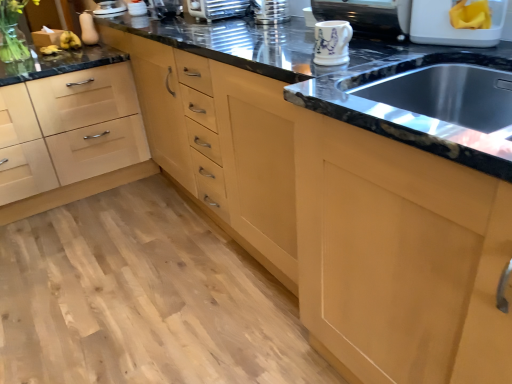
Question: Is clear glass vase at upper left to the left of metallic silver toaster at upper center, the 4th appliance when ordered from right to left, from the viewer's perspective?

Choices:
 (A) no
 (B) yes

Answer: (B)

Question: Does clear glass vase at upper left have a smaller size compared to metallic silver toaster at upper center, the 4th appliance when ordered from right to left?

Choices:
 (A) yes
 (B) no

Answer: (B)

Question: From the image's perspective, is clear glass vase at upper left beneath metallic silver toaster at upper center, the 4th appliance when ordered from right to left?

Choices:
 (A) no
 (B) yes

Answer: (A)

Question: Are clear glass vase at upper left and metallic silver toaster at upper center, the 4th appliance when ordered from right to left, beside each other?

Choices:
 (A) no
 (B) yes

Answer: (A)

Question: Is clear glass vase at upper left bigger than metallic silver toaster at upper center, the 4th appliance when ordered from right to left?

Choices:
 (A) yes
 (B) no

Answer: (A)

Question: From a real-world perspective, is clear glass vase at upper left beneath metallic silver toaster at upper center, which is the 5th appliance in left-to-right order?

Choices:
 (A) yes
 (B) no

Answer: (A)

Question: Is metallic silver toaster at upper center, acting as the third appliance starting from the left, shorter than white glossy mug at upper center, which is the 2th appliance in right-to-left order?

Choices:
 (A) yes
 (B) no

Answer: (B)

Question: Can you confirm if metallic silver toaster at upper center, the 6th appliance in the right-to-left sequence, is taller than white glossy mug at upper center, the seventh appliance in the left-to-right sequence?

Choices:
 (A) yes
 (B) no

Answer: (A)

Question: Is metallic silver toaster at upper center, the 6th appliance in the right-to-left sequence, oriented towards white glossy mug at upper center, which is the 2th appliance in right-to-left order?

Choices:
 (A) yes
 (B) no

Answer: (B)

Question: Is metallic silver toaster at upper center, acting as the third appliance starting from the left, closer to the viewer compared to white glossy mug at upper center, the seventh appliance in the left-to-right sequence?

Choices:
 (A) yes
 (B) no

Answer: (B)

Question: Could white glossy mug at upper center, which is the 2th appliance in right-to-left order, be considered to be inside metallic silver toaster at upper center, the 6th appliance in the right-to-left sequence?

Choices:
 (A) yes
 (B) no

Answer: (B)

Question: Is metallic silver toaster at upper center, the 6th appliance in the right-to-left sequence, positioned with its back to white glossy mug at upper center, which is the 2th appliance in right-to-left order?

Choices:
 (A) yes
 (B) no

Answer: (B)

Question: Is white plastic container at upper right, which ranks as the 1th appliance in right-to-left order, further to camera compared to porcelain mug at upper center, the 3th appliance when ordered from right to left?

Choices:
 (A) yes
 (B) no

Answer: (A)